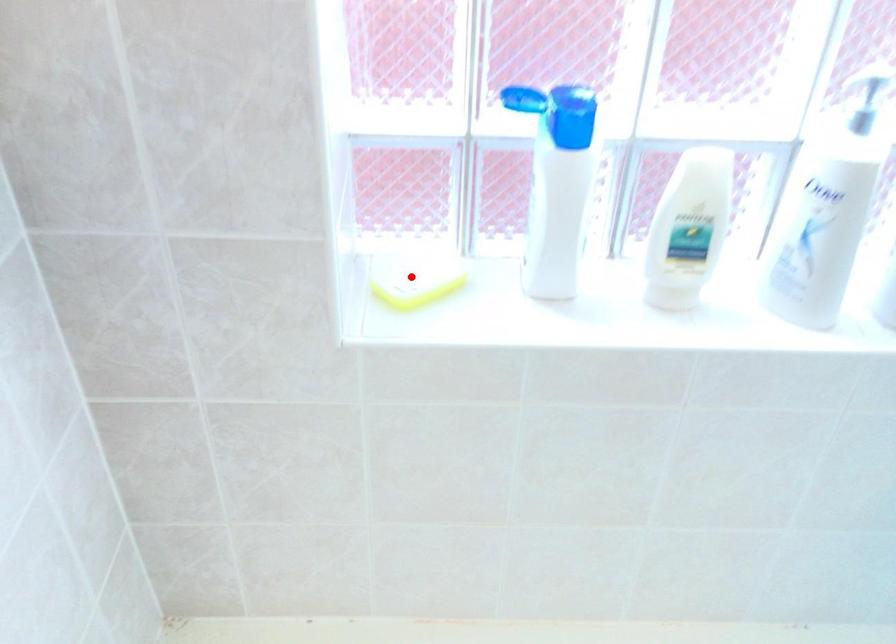
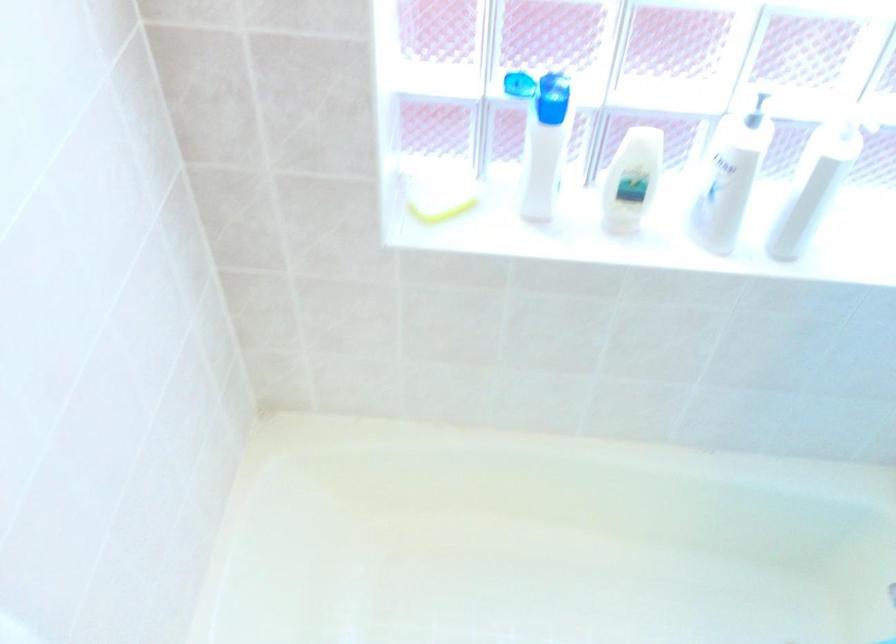
Where in the second image is the point corresponding to the highlighted location from the first image?

(438, 196)